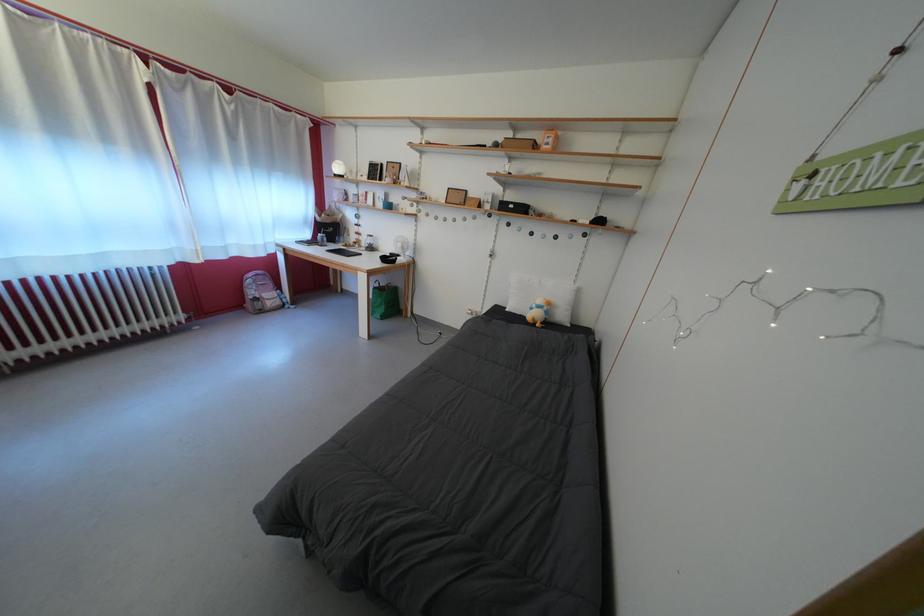
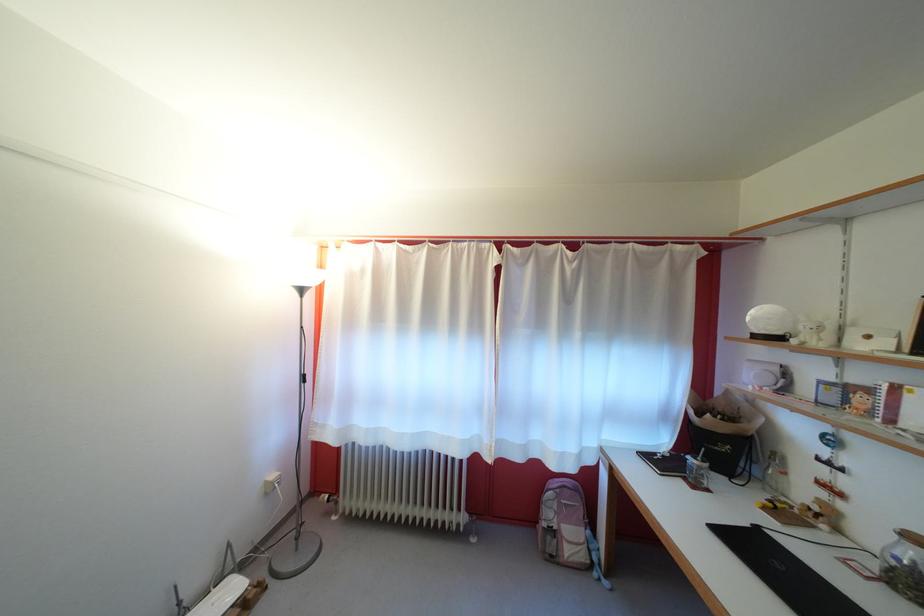
The point at [261,299] is marked in the first image. Where is the corresponding point in the second image?

(556, 521)